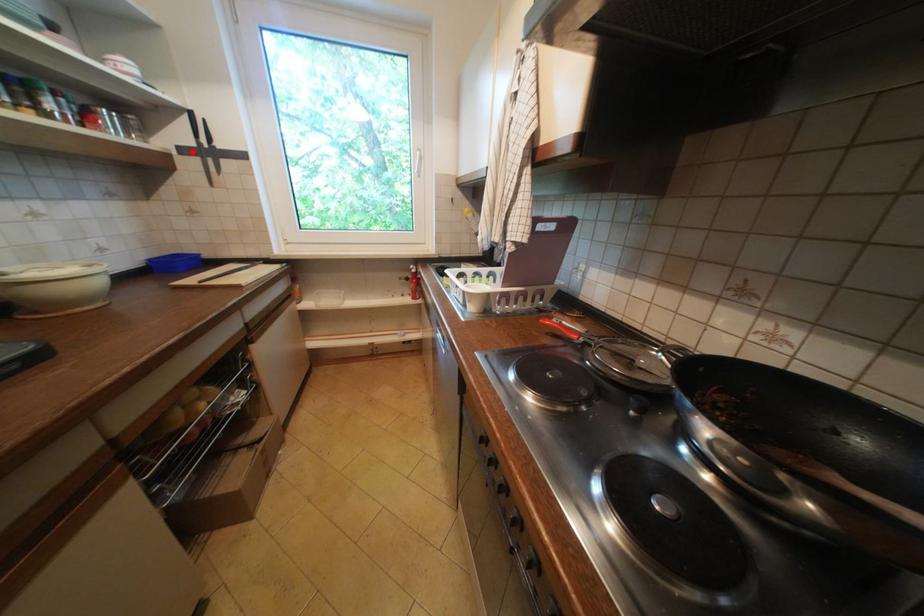
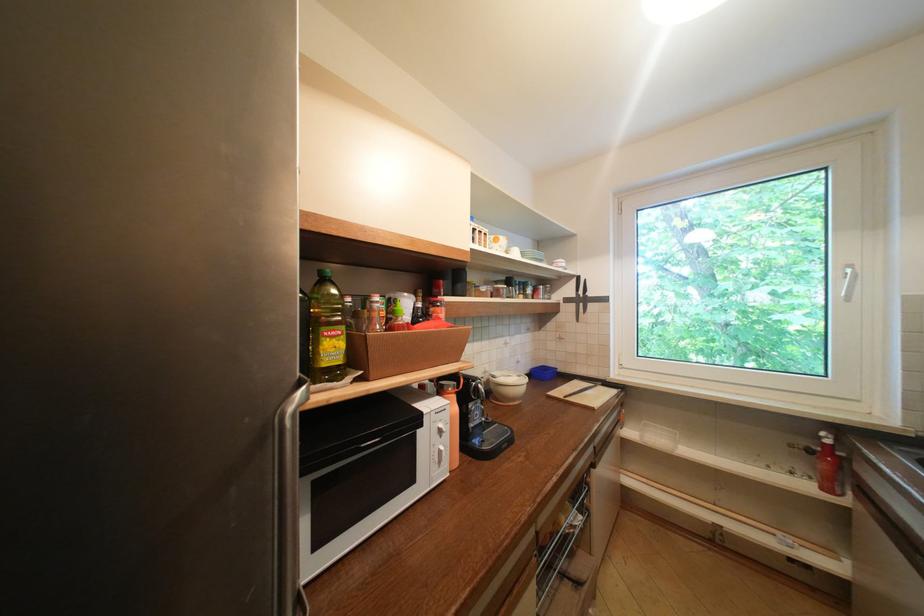
The point at the highlighted location is marked in the first image. Where is the corresponding point in the second image?

(575, 301)